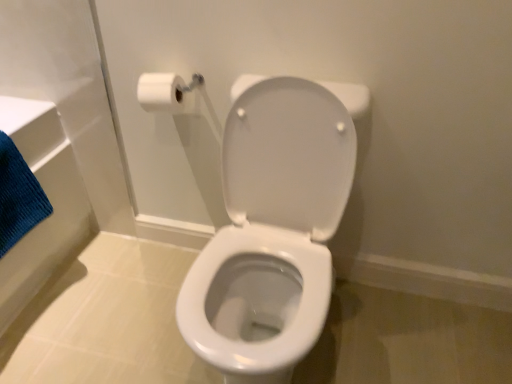
Question: Looking at their shapes, would you say blue textured bath towel at left is wider or thinner than white matte toilet paper at upper left?

Choices:
 (A) wide
 (B) thin

Answer: (A)

Question: In terms of height, does blue textured bath towel at left look taller or shorter compared to white matte toilet paper at upper left?

Choices:
 (A) tall
 (B) short

Answer: (A)

Question: Estimate the real-world distances between objects in this image. Which object is closer to the white matte toilet paper at upper left?

Choices:
 (A) blue textured bath towel at left
 (B) white glossy toilet at center

Answer: (B)

Question: Considering the real-world distances, which object is farthest from the white matte toilet paper at upper left?

Choices:
 (A) white glossy toilet at center
 (B) blue textured bath towel at left

Answer: (B)